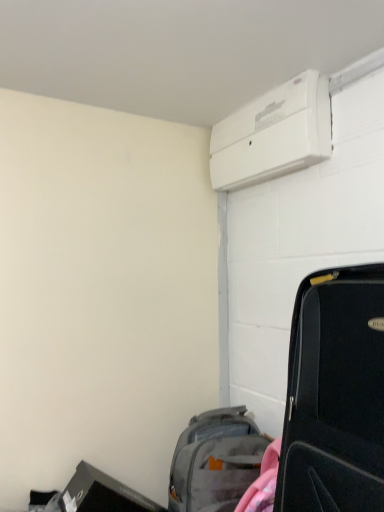
Question: Considering the relative sizes of black matte suitcase at right and gray fabric backpack at lower center in the image provided, is black matte suitcase at right smaller than gray fabric backpack at lower center?

Choices:
 (A) yes
 (B) no

Answer: (B)

Question: Is black matte suitcase at right in contact with gray fabric backpack at lower center?

Choices:
 (A) yes
 (B) no

Answer: (B)

Question: Is black matte suitcase at right to the right of gray fabric backpack at lower center from the viewer's perspective?

Choices:
 (A) no
 (B) yes

Answer: (B)

Question: Is black matte suitcase at right wider than gray fabric backpack at lower center?

Choices:
 (A) yes
 (B) no

Answer: (A)

Question: Considering the relative positions of black matte suitcase at right and gray fabric backpack at lower center in the image provided, is black matte suitcase at right to the left of gray fabric backpack at lower center from the viewer's perspective?

Choices:
 (A) no
 (B) yes

Answer: (A)

Question: From a real-world perspective, is black matte suitcase at right under gray fabric backpack at lower center?

Choices:
 (A) no
 (B) yes

Answer: (A)

Question: Does gray fabric backpack at lower center have a greater width compared to black matte suitcase at right?

Choices:
 (A) no
 (B) yes

Answer: (A)

Question: Considering the relative sizes of gray fabric backpack at lower center and black matte suitcase at right in the image provided, is gray fabric backpack at lower center taller than black matte suitcase at right?

Choices:
 (A) no
 (B) yes

Answer: (A)

Question: From the image's perspective, is gray fabric backpack at lower center under black matte suitcase at right?

Choices:
 (A) no
 (B) yes

Answer: (B)

Question: Does gray fabric backpack at lower center have a lesser width compared to black matte suitcase at right?

Choices:
 (A) yes
 (B) no

Answer: (A)

Question: Can black matte suitcase at right be found inside gray fabric backpack at lower center?

Choices:
 (A) yes
 (B) no

Answer: (B)

Question: Is the depth of gray fabric backpack at lower center less than that of black matte suitcase at right?

Choices:
 (A) no
 (B) yes

Answer: (A)

Question: Based on their sizes in the image, would you say gray fabric backpack at lower center is bigger or smaller than black matte suitcase at right?

Choices:
 (A) big
 (B) small

Answer: (B)